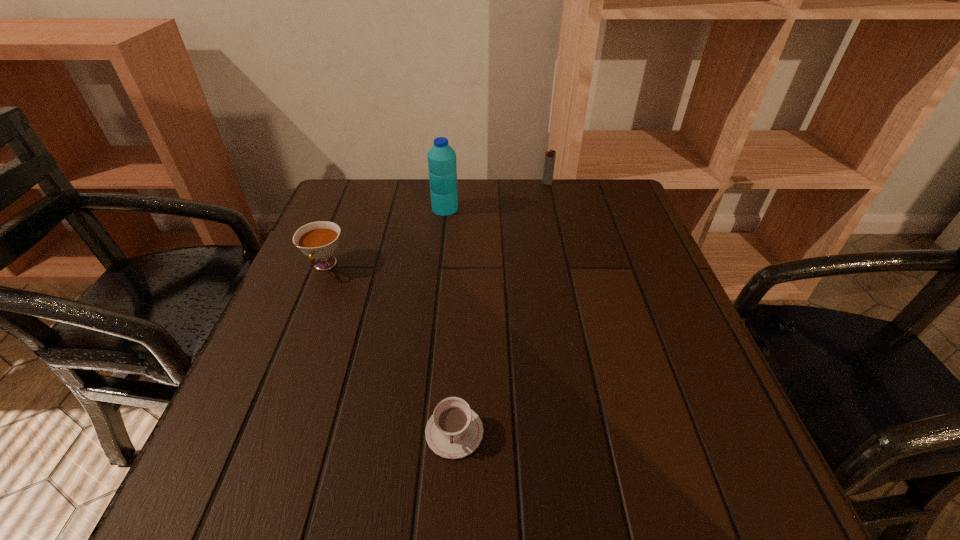
I want to click on vacant space located on the side of the leftmost object with the handle, so click(x=266, y=412).

This screenshot has width=960, height=540. I want to click on vacant point located on the handle side of the nearer teacup, so click(x=451, y=510).

Find the location of a particular element. Image resolution: width=960 pixels, height=540 pixels. water bottle that is at the far edge is located at coordinates (442, 166).

Find the location of a particular element. This screenshot has width=960, height=540. igniter present at the far edge is located at coordinates (549, 162).

I want to click on object at the near edge, so click(454, 431).

Locate an element on the screen. object located in the left edge section of the desktop is located at coordinates (319, 240).

Where is `vacant area at the far edge`? The width and height of the screenshot is (960, 540). vacant area at the far edge is located at coordinates (515, 202).

Image resolution: width=960 pixels, height=540 pixels. I want to click on blank space at the near edge, so click(637, 473).

The width and height of the screenshot is (960, 540). In order to click on vacant space at the right edge of the desktop in this screenshot , I will do pyautogui.click(x=673, y=303).

Where is `free spot at the far left corner of the desktop`? free spot at the far left corner of the desktop is located at coordinates (378, 202).